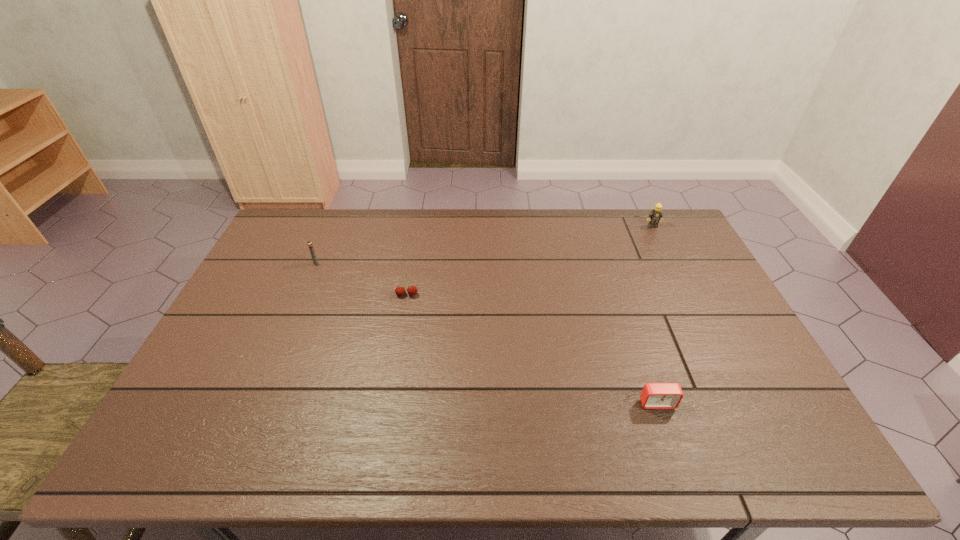
Where is `the rightmost object`? the rightmost object is located at coordinates (656, 215).

Where is `the farthest object`? Image resolution: width=960 pixels, height=540 pixels. the farthest object is located at coordinates (656, 215).

I want to click on the leftmost object, so click(x=309, y=243).

This screenshot has width=960, height=540. I want to click on igniter, so click(x=309, y=243).

This screenshot has width=960, height=540. Identify the location of cherry. (412, 290).

Where is `the third farthest object`? The image size is (960, 540). the third farthest object is located at coordinates (412, 290).

Where is `the nearest object`? Image resolution: width=960 pixels, height=540 pixels. the nearest object is located at coordinates (654, 395).

You are a GUI agent. You are given a task and a screenshot of the screen. Output one action in this format:
    pyautogui.click(x=<x>, y=<y>)
    Task: Click on the alarm clock
    
    Given the screenshot: What is the action you would take?
    pyautogui.click(x=654, y=395)

This screenshot has width=960, height=540. I want to click on free space located 0.340m in front of the Lego, so click(685, 292).

The image size is (960, 540). I want to click on free spot located on the left of the igniter, so click(280, 264).